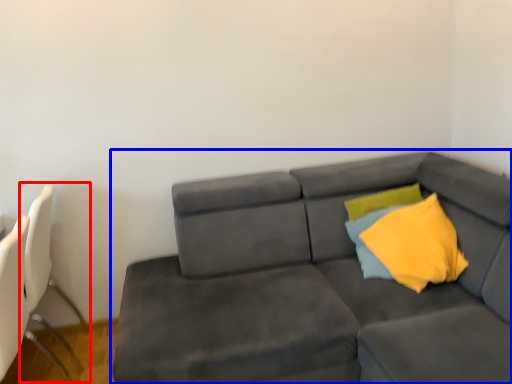
Question: Among these objects, which one is farthest to the camera, swivel chair (highlighted by a red box) or studio couch (highlighted by a blue box)?

Choices:
 (A) swivel chair
 (B) studio couch

Answer: (A)